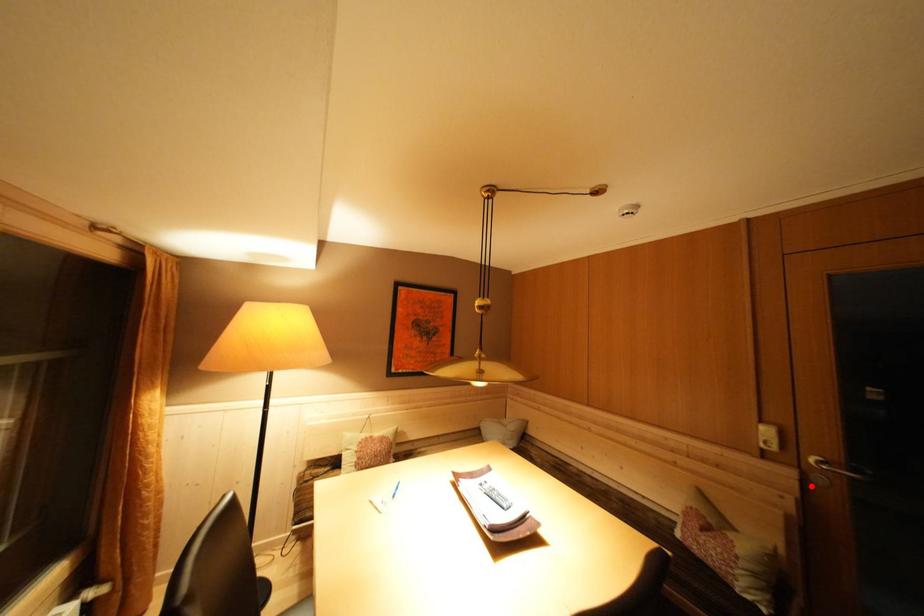
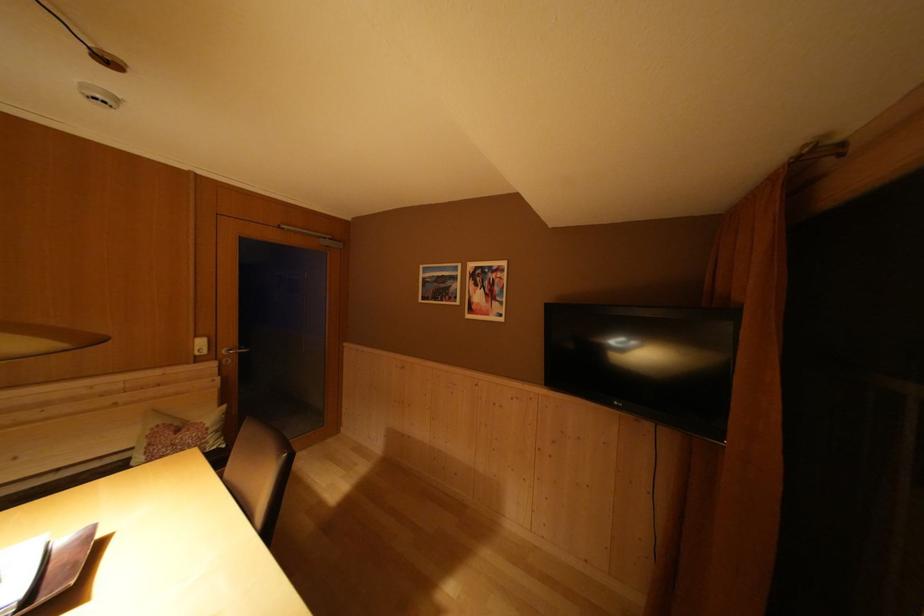
Find the pixel in the second image that matches the highlighted location in the first image.

(226, 371)